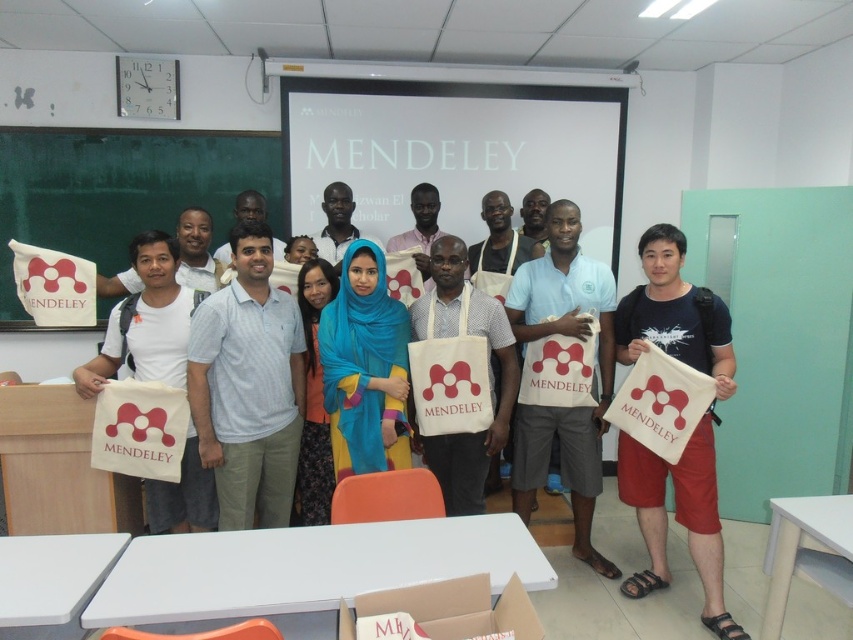
Between point (654, 244) and point (543, 272), which one is positioned in front?

Point (654, 244) is more forward.

Is white canvas bag at center bigger than matte white bag at center?

No.

Which is in front, point (683, 477) or point (524, 365)?

Point (683, 477)

Identify the location of white canvas bag at center. This screenshot has width=853, height=640. (677, 516).

Who is taller, green chalkboard at left or matte white bag at center?

matte white bag at center is taller.

Consider the image. Is green chalkboard at left to the left of matte white bag at center from the viewer's perspective?

Indeed, green chalkboard at left is positioned on the left side of matte white bag at center.

Does point (123, 227) lie behind point (529, 508)?

Yes, point (123, 227) is farther from viewer.

Where is `green chalkboard at left`? The width and height of the screenshot is (853, 640). green chalkboard at left is located at coordinates (122, 189).

Which of these two, green chalkboard at left or white canvas bag at center, stands shorter?

With less height is green chalkboard at left.

Is point (178, 204) positioned before point (715, 502)?

No, it is not.

Image resolution: width=853 pixels, height=640 pixels. In order to click on green chalkboard at left in this screenshot , I will do `click(122, 189)`.